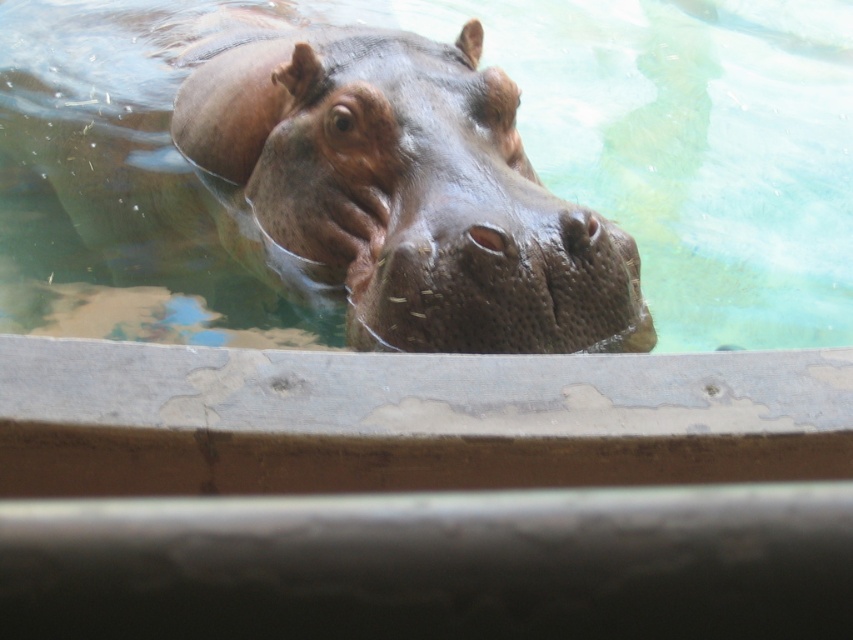
Who is shorter, smooth concrete pool at center or sandy brown textured nose at center?

With less height is sandy brown textured nose at center.

Can you confirm if smooth concrete pool at center is bigger than sandy brown textured nose at center?

Yes, smooth concrete pool at center is bigger than sandy brown textured nose at center.

The height and width of the screenshot is (640, 853). Identify the location of smooth concrete pool at center. (440, 172).

Identify the location of smooth concrete pool at center. This screenshot has width=853, height=640. (440, 172).

Can you confirm if brown rough skin at center is positioned above sandy brown textured nose at center?

Yes.

Where is `brown rough skin at center`? This screenshot has width=853, height=640. brown rough skin at center is located at coordinates (355, 216).

The width and height of the screenshot is (853, 640). In order to click on brown rough skin at center in this screenshot , I will do `click(355, 216)`.

Who is higher up, smooth concrete pool at center or brown rough skin at center?

smooth concrete pool at center

This screenshot has width=853, height=640. In order to click on smooth concrete pool at center in this screenshot , I will do `click(440, 172)`.